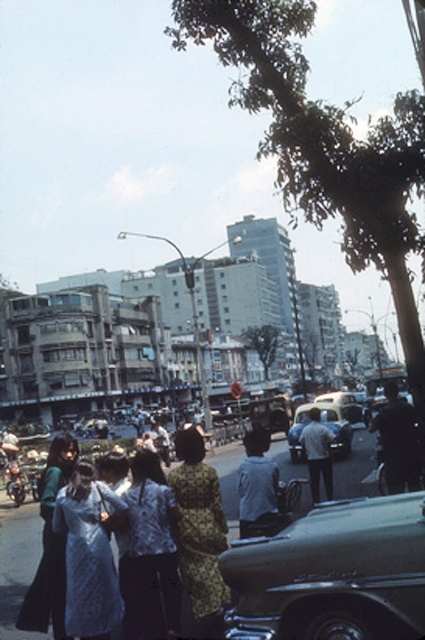
You are a photographer standing at the edge of the street. You want to capture a photo that includes both the silky white dress at lower left and the metallic silver car at center. Based on their positions, which object is closer to the left side of the photo frame?

The silky white dress at lower left is to the left of the metallic silver car at center, so it is closer to the left side of the photo frame.

You are standing on the bustling urban street scene described. You see two points marked in the image, one at coordinates point (153, 477) and the other at point (303, 404). Which point is nearer to you?

Point (153, 477) is closer to the viewer than point (303, 404).

You are a photographer trying to capture a clear shot of the printed fabric blouse at center and the metallic silver car at center in this urban scene. Since you want both subjects to be equally prominent in the photo, which object should you zoom in on more to balance their sizes?

The printed fabric blouse at center has a lesser width compared to the metallic silver car at center, so you should zoom in more on the printed fabric blouse at center to make it appear larger and balance its size with the metallic silver car at center in the photo.